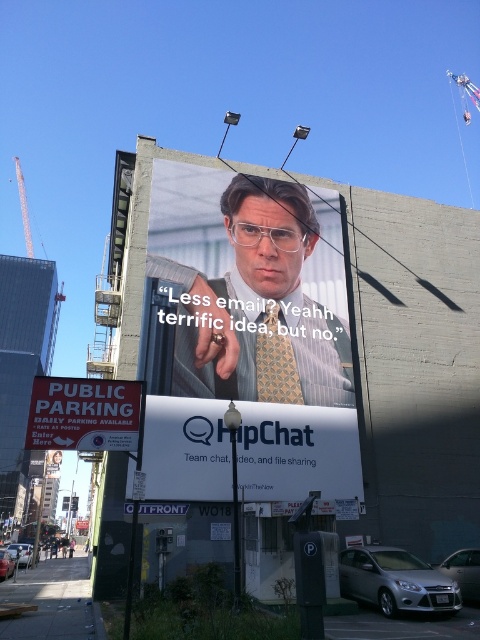
Question: Can you confirm if matte yellow tie at center is bigger than red signboard at lower left?

Choices:
 (A) no
 (B) yes

Answer: (B)

Question: Does red signboard at lower left appear on the right side of patterned silk tie at center?

Choices:
 (A) no
 (B) yes

Answer: (A)

Question: Which of the following is the closest to the observer?

Choices:
 (A) matte yellow tie at center
 (B) red signboard at lower left
 (C) patterned silk tie at center

Answer: (B)

Question: Does red signboard at lower left appear over patterned silk tie at center?

Choices:
 (A) yes
 (B) no

Answer: (B)

Question: Which object is positioned farthest from the matte yellow tie at center?

Choices:
 (A) red signboard at lower left
 (B) patterned silk tie at center
 (C) white paper at center

Answer: (A)

Question: Which point is closer to the camera taking this photo?

Choices:
 (A) (305, 220)
 (B) (263, 348)

Answer: (B)